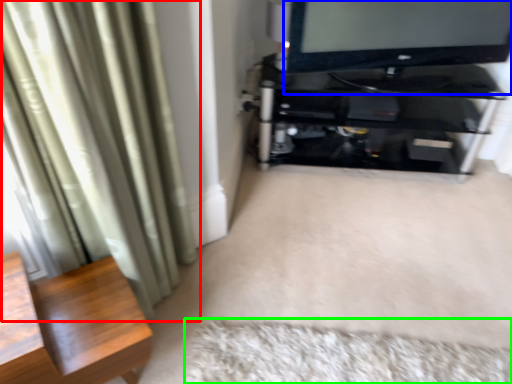
Question: Which object is positioned farthest from curtain (highlighted by a red box)? Select from television (highlighted by a blue box) and mat (highlighted by a green box).

Choices:
 (A) television
 (B) mat

Answer: (A)